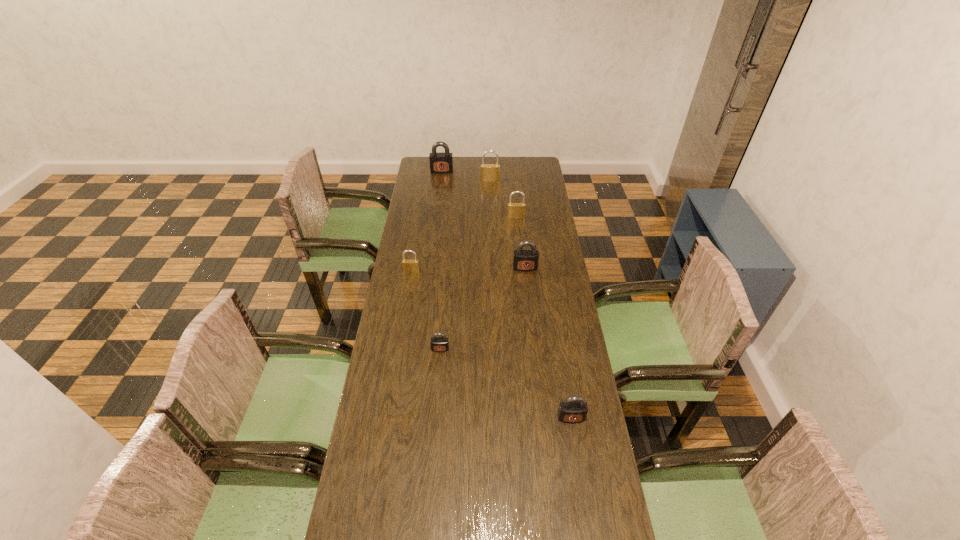
Locate an element on the screen. The image size is (960, 540). the closest object to the nearest brass padlock is located at coordinates (438, 344).

Find the location of `the second closest object to the farthest brass padlock`. the second closest object to the farthest brass padlock is located at coordinates (514, 210).

This screenshot has height=540, width=960. I want to click on the second closest padlock to the leftmost brass padlock, so click(x=525, y=260).

Identify which padlock is the fourth closest to the rightmost object. Please provide its 2D coordinates. Your answer should be formatted as a tuple, i.e. [(x, y)], where the tuple contains the x and y coordinates of a point satisfying the conditions above.

[(514, 210)]

Locate an element on the screen. This screenshot has width=960, height=540. the closest gray padlock relative to the sixth nearest padlock is located at coordinates (442, 162).

Select which gray padlock is the closest to the third smallest gray padlock. Please provide its 2D coordinates. Your answer should be formatted as a tuple, i.e. [(x, y)], where the tuple contains the x and y coordinates of a point satisfying the conditions above.

[(438, 344)]

Locate an element on the screen. brass padlock that is the closest to the farthest padlock is located at coordinates (489, 172).

At what (x,y) coordinates should I click in order to perform the action: click on brass padlock that is the second closest to the second smallest brass padlock. Please return your answer as a coordinate pair (x, y). Looking at the image, I should click on (409, 266).